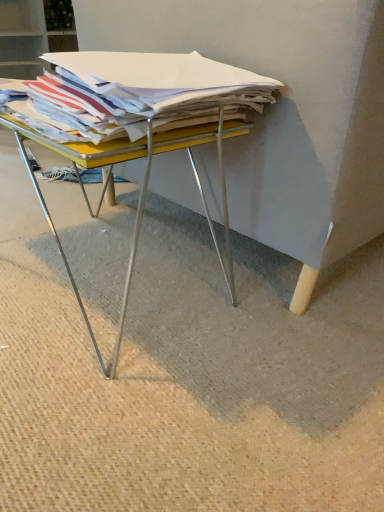
Question: From the image's perspective, is white paper stack at center below yellow metal desk at center?

Choices:
 (A) no
 (B) yes

Answer: (A)

Question: Is white paper stack at center positioned before yellow metal desk at center?

Choices:
 (A) no
 (B) yes

Answer: (B)

Question: Is white paper stack at center smaller than yellow metal desk at center?

Choices:
 (A) yes
 (B) no

Answer: (A)

Question: Does white paper stack at center turn towards yellow metal desk at center?

Choices:
 (A) no
 (B) yes

Answer: (A)

Question: Is white paper stack at center taller than yellow metal desk at center?

Choices:
 (A) no
 (B) yes

Answer: (A)

Question: Can you confirm if white paper stack at center is thinner than yellow metal desk at center?

Choices:
 (A) yes
 (B) no

Answer: (A)

Question: Is white paper stack at center completely or partially inside yellow metal desk at center?

Choices:
 (A) yes
 (B) no

Answer: (B)

Question: Is yellow metal desk at center looking in the opposite direction of white paper stack at center?

Choices:
 (A) yes
 (B) no

Answer: (B)

Question: From a real-world perspective, does yellow metal desk at center sit lower than white paper stack at center?

Choices:
 (A) yes
 (B) no

Answer: (A)

Question: Considering the relative sizes of yellow metal desk at center and white paper stack at center in the image provided, is yellow metal desk at center taller than white paper stack at center?

Choices:
 (A) yes
 (B) no

Answer: (A)

Question: Does yellow metal desk at center have a lesser width compared to white paper stack at center?

Choices:
 (A) yes
 (B) no

Answer: (B)

Question: Is the position of yellow metal desk at center less distant than that of white paper stack at center?

Choices:
 (A) no
 (B) yes

Answer: (A)

Question: From their relative heights in the image, would you say yellow metal desk at center is taller or shorter than white paper stack at center?

Choices:
 (A) short
 (B) tall

Answer: (B)